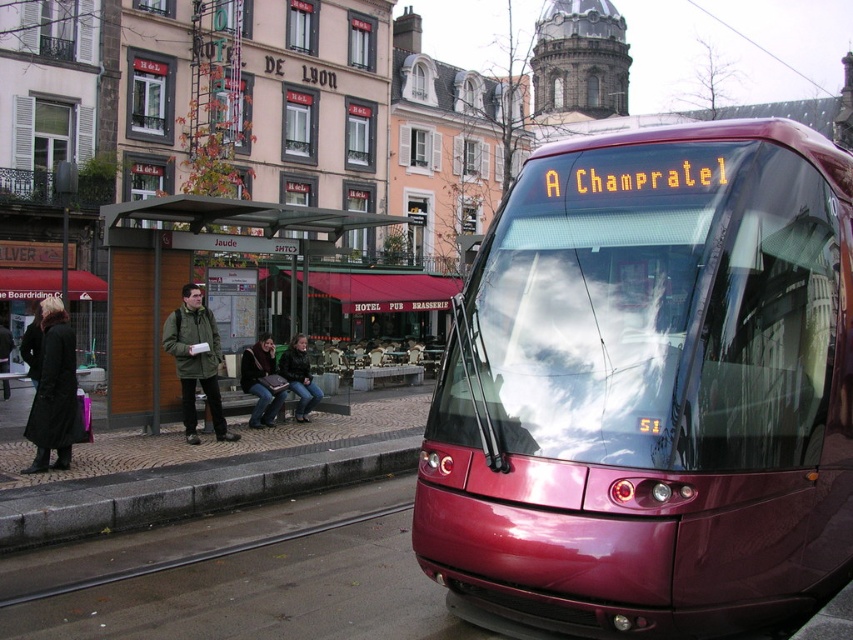
Question: Estimate the real-world distances between objects in this image. Which object is farther from the dark brown leather jacket at center?

Choices:
 (A) green matte jacket at left
 (B) wooden bench at left

Answer: (B)

Question: Based on their relative distances, which object is farther from the green matte jacket at left?

Choices:
 (A) gray concrete curb at lower left
 (B) shiny maroon tram at center

Answer: (B)

Question: Does gray concrete curb at lower left appear over black leather coat at left?

Choices:
 (A) no
 (B) yes

Answer: (A)

Question: Does green matte jacket at left appear on the left side of dark green leather jacket at center?

Choices:
 (A) yes
 (B) no

Answer: (A)

Question: Is wooden bench at left wider than dark green leather jacket at center?

Choices:
 (A) no
 (B) yes

Answer: (B)

Question: Which object appears farthest from the camera in this image?

Choices:
 (A) shiny maroon tram at center
 (B) dark brown leather jacket at center

Answer: (B)